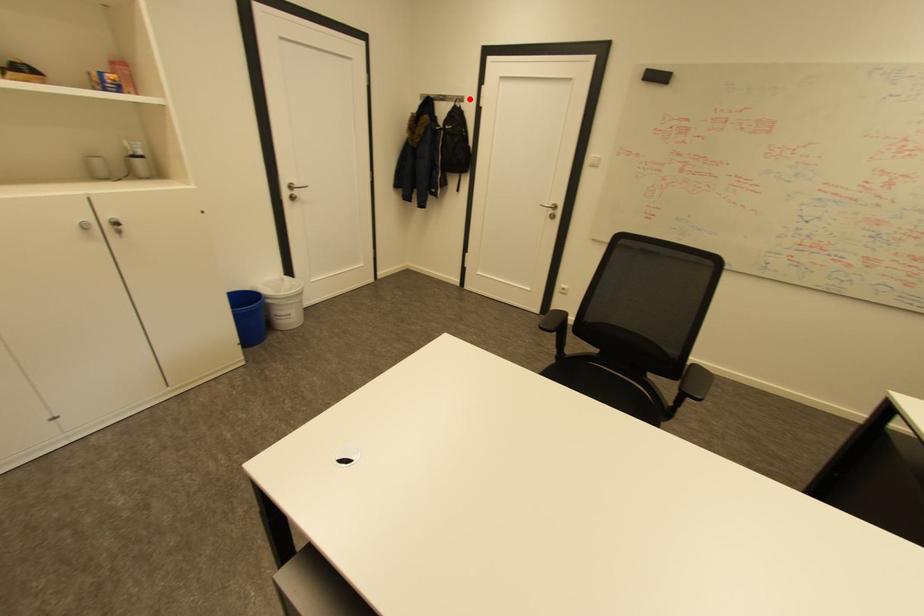
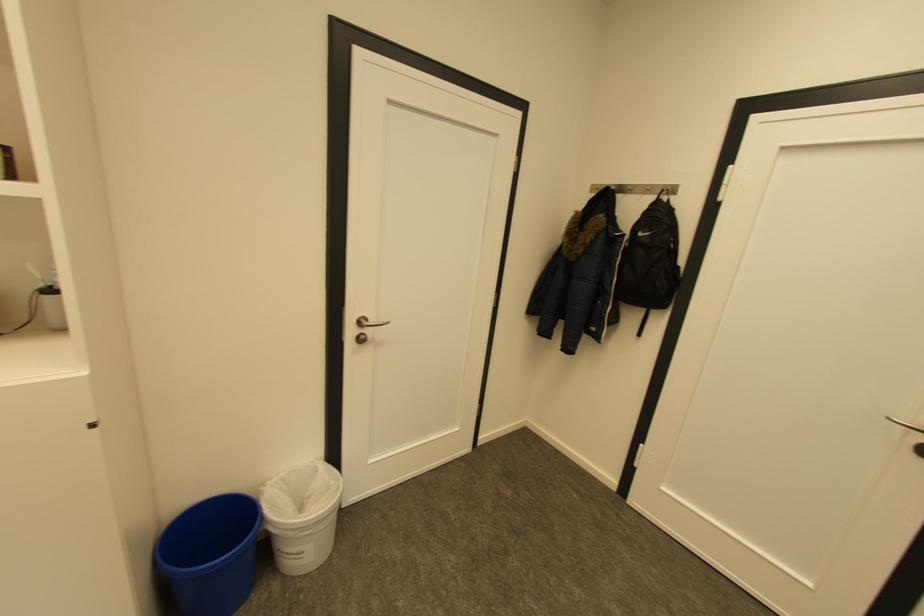
Locate, in the second image, the point that corresponds to the highlighted location in the first image.

(677, 190)